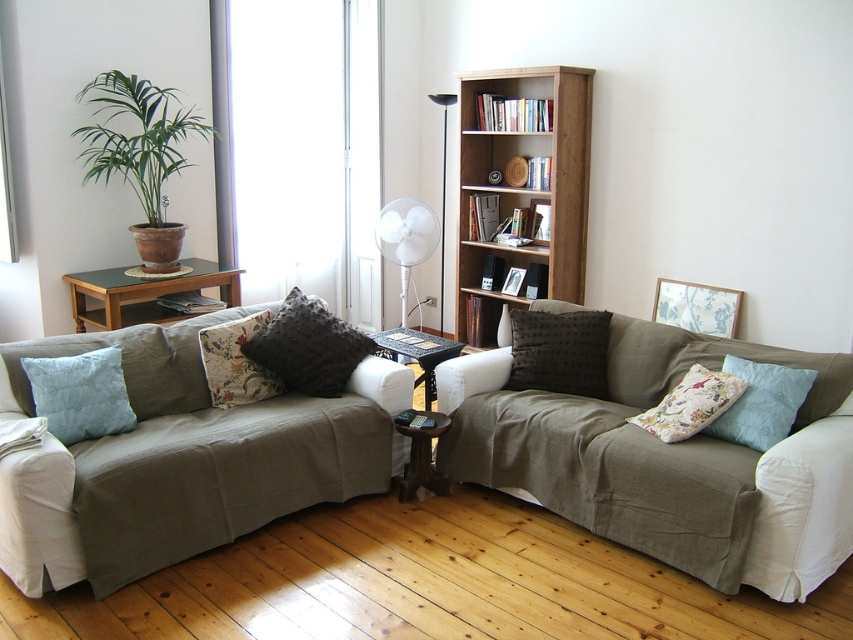
Can you confirm if matte brown couch at center is shorter than green leafy plant at upper left?

In fact, matte brown couch at center may be taller than green leafy plant at upper left.

Is matte brown couch at center positioned in front of green leafy plant at upper left?

That is True.

Between point (851, 387) and point (178, 104), which one is positioned in front?

Point (851, 387) is in front.

Image resolution: width=853 pixels, height=640 pixels. Identify the location of matte brown couch at center. (665, 460).

Who is more distant from viewer, (90, 160) or (445, 168)?

Positioned behind is point (445, 168).

Where is `green leafy plant at upper left`? green leafy plant at upper left is located at coordinates (136, 136).

Where is `green leafy plant at upper left`? green leafy plant at upper left is located at coordinates (136, 136).

Based on the photo, is textured dark gray pillow at center wider than light blue quilted pillow at left?

Indeed, textured dark gray pillow at center has a greater width compared to light blue quilted pillow at left.

This screenshot has height=640, width=853. I want to click on textured dark gray pillow at center, so click(x=308, y=348).

Where is `textured dark gray pillow at center`? The height and width of the screenshot is (640, 853). textured dark gray pillow at center is located at coordinates (308, 348).